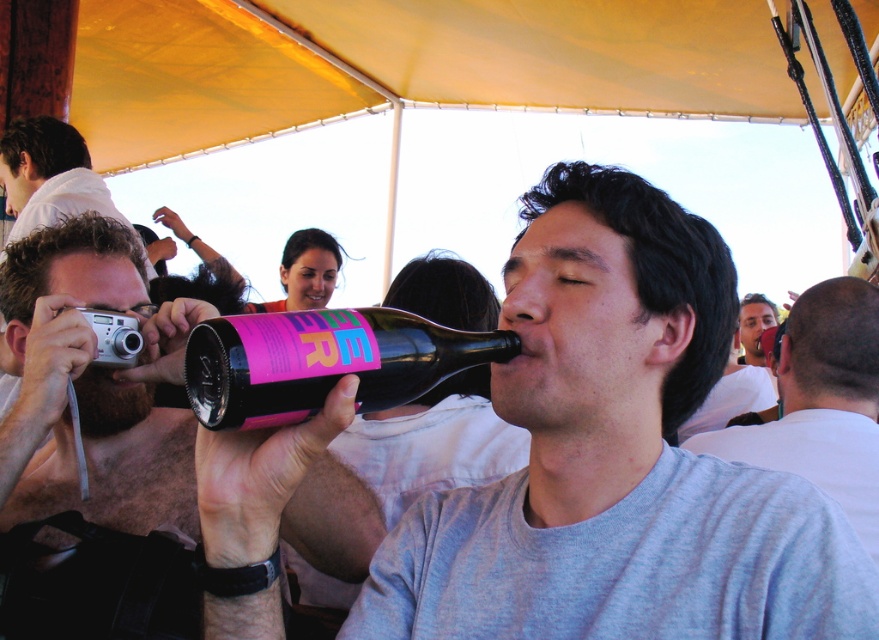
Does shiny metallic camera at upper left come behind curly hair at upper left?

No.

The height and width of the screenshot is (640, 879). What do you see at coordinates (118, 440) in the screenshot? I see `shiny metallic camera at upper left` at bounding box center [118, 440].

Identify the location of shiny metallic camera at upper left. The height and width of the screenshot is (640, 879). (118, 440).

Find the location of a particular element. shiny metallic camera at upper left is located at coordinates (118, 440).

Is point (499, 568) positioned in front of point (281, 362)?

No, (499, 568) is further to viewer.

Can you confirm if matte black bottle at center is positioned to the right of black matte bottle at center?

Indeed, matte black bottle at center is positioned on the right side of black matte bottle at center.

Measure the distance between point (855, 627) and camera.

The distance of point (855, 627) from camera is 29.12 inches.

This screenshot has width=879, height=640. Identify the location of matte black bottle at center. (616, 458).

Between matte black bottle at center and gray matte shirt at center, which one is positioned higher?

matte black bottle at center is above.

Between matte black bottle at center and gray matte shirt at center, which one has less height?

Standing shorter between the two is gray matte shirt at center.

The image size is (879, 640). What are the coordinates of `matte black bottle at center` in the screenshot? It's located at (616, 458).